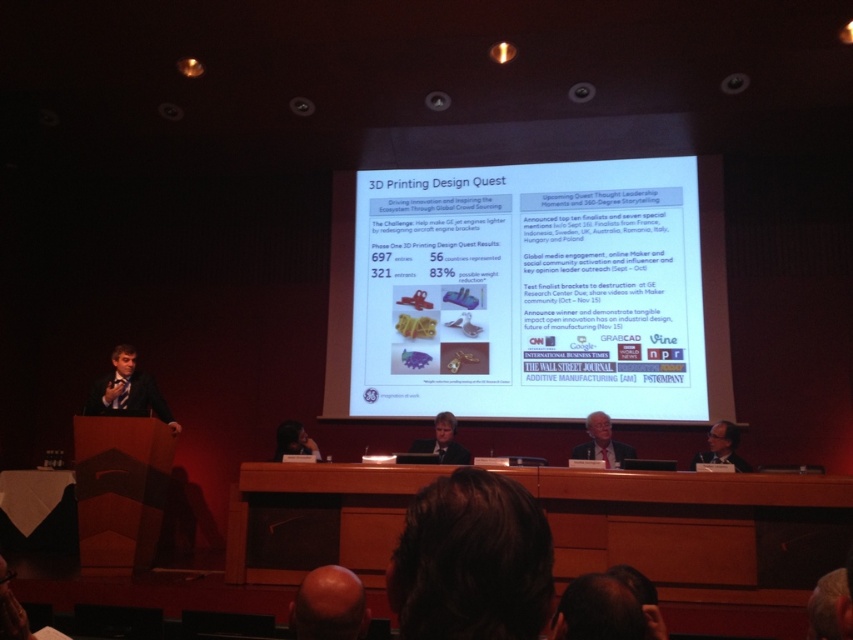
You are a stagehand who needs to move a 2 meter long ladder from the gray fabric suit at center to the dark brown leather chair at lower center. Can you move it without tilting the ladder?

The distance between the gray fabric suit at center and the dark brown leather chair at lower center is 2.17 meters. Since the ladder is 2 meters long, it can be moved horizontally as the space available is greater than the ladder length.

You are an attendee sitting in the front row of the conference hall. You notice two points on the projection screen during the presentation. The first point is labeled as point 1 at coordinates [114,376] and the second point is labeled as point 2 at coordinates [619,454]. From your perspective, which point is closer to the bottom edge of the screen?

Point 2 at coordinates [619,454] is closer to the bottom edge of the screen because its y coordinate is higher than point 1. In coordinate systems, higher y values typically indicate positions closer to the bottom.